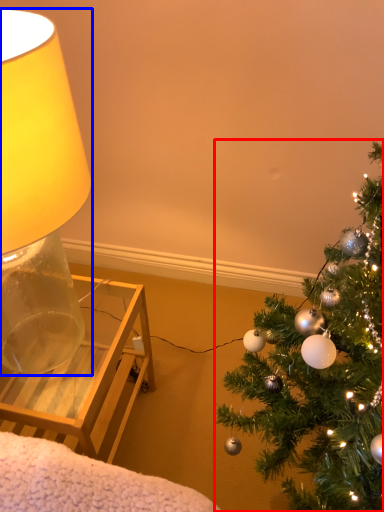
Question: Which point is closer to the camera, christmas tree (highlighted by a red box) or lamp (highlighted by a blue box)?

Choices:
 (A) christmas tree
 (B) lamp

Answer: (A)